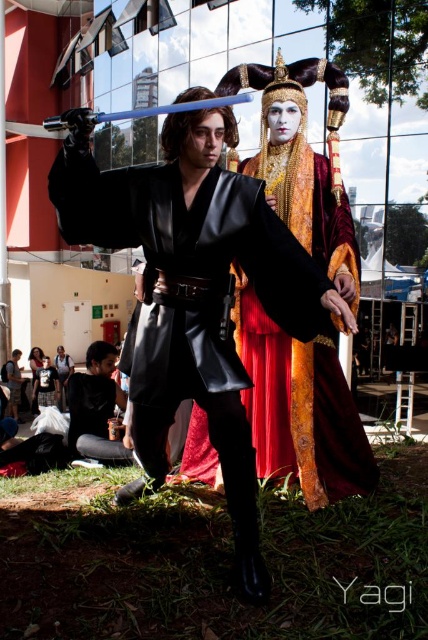
You are a photographer at a costume party. You need to position the two guests so that the smooth gold dress at center and the matte black dress at lower left are visible in the frame. Based on their current positions, which dress is closer to the right edge of the photo?

The smooth gold dress at center is closer to the right edge of the photo because it is positioned to the right of the matte black dress at lower left.

You are a photographer setting up for a photoshoot with two models wearing the black leather kimono at center and the matte black kimono at center. You need to position them so that they are exactly 2 meters apart for the shot. Based on their current positions, will you need to move them closer together or farther apart?

The black leather kimono at center and matte black kimono at center are currently 3.42 meters apart. Since the desired distance is 2 meters, they need to move closer together by 1.42 meters to achieve the required spacing.

You are a photographer trying to capture a closeup shot of the foreground character holding the blue lightsaber. You notice two points marked in the image at coordinates point (228, 435) and point (265, 458). Which of these points is nearer to your camera lens?

Point (228, 435) is closer to the camera than point (265, 458), so the photographer should focus on that point for a closer shot.